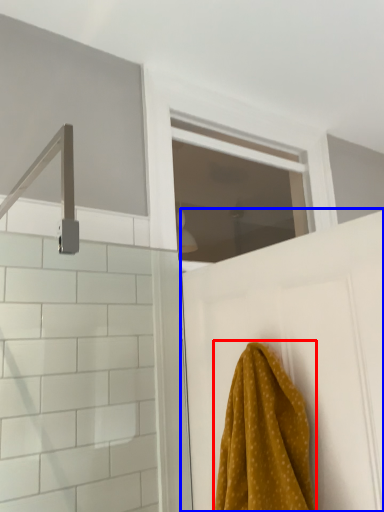
Question: Among these objects, which one is farthest to the camera, towel (highlighted by a red box) or door (highlighted by a blue box)?

Choices:
 (A) towel
 (B) door

Answer: (B)